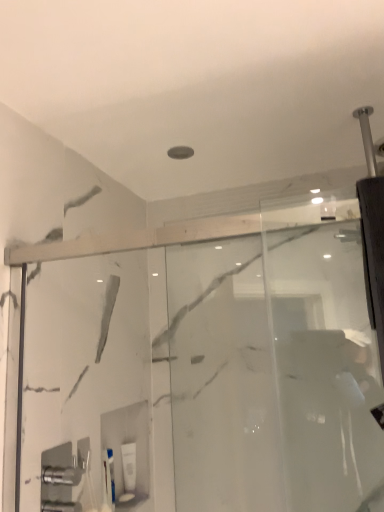
You are a GUI agent. You are given a task and a screenshot of the screen. Output one action in this format:
    pyautogui.click(x=<x>, y=<y>)
    Task: Click on the white matte tube at lower center
    
    Given the screenshot: What is the action you would take?
    pyautogui.click(x=129, y=466)

This screenshot has width=384, height=512. Describe the element at coordinates (129, 466) in the screenshot. I see `white matte tube at lower center` at that location.

The width and height of the screenshot is (384, 512). I want to click on white matte tube at lower center, so click(x=129, y=466).